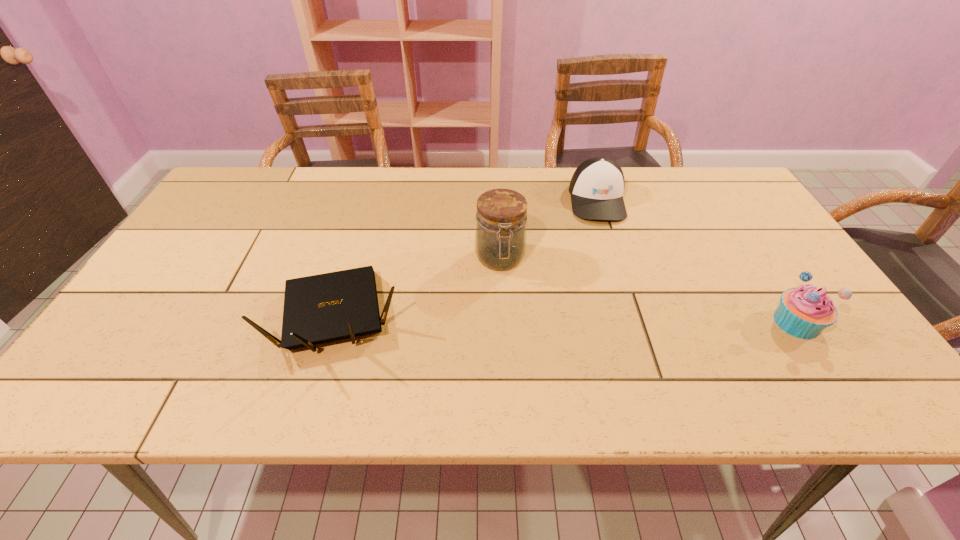
I want to click on vacant space on the desktop that is between the leftmost object and the muffin and is positioned on the lid of the second object from left to right, so click(509, 319).

This screenshot has height=540, width=960. Find the location of `free space on the desktop that is between the leftmost object and the rightmost object and is positioned on the front panel of the farthest object`. free space on the desktop that is between the leftmost object and the rightmost object and is positioned on the front panel of the farthest object is located at coordinates (622, 320).